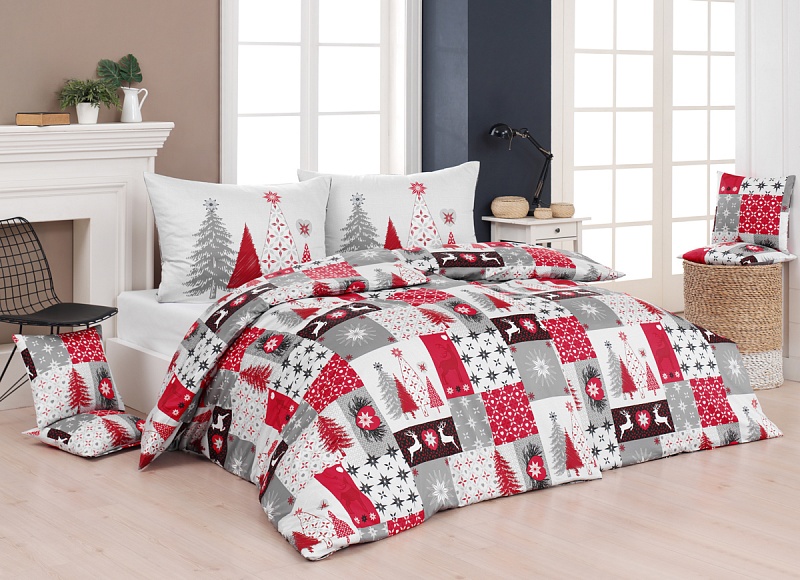
You are a GUI agent. You are given a task and a screenshot of the screen. Output one action in this format:
    pyautogui.click(x=<x>, y=<y>)
    Task: Click on the floor
    This screenshot has height=580, width=800.
    Given the screenshot: What is the action you would take?
    pyautogui.click(x=632, y=521)